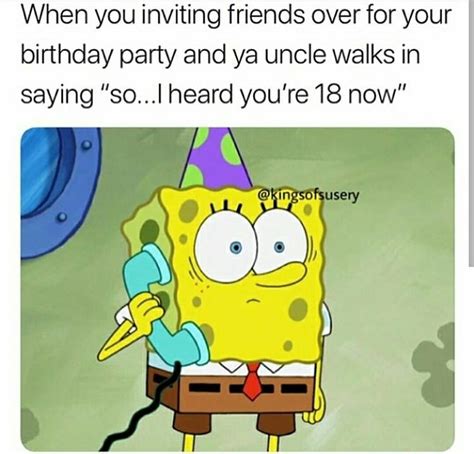
Identify the location of glass. The image size is (474, 454). (29, 160).